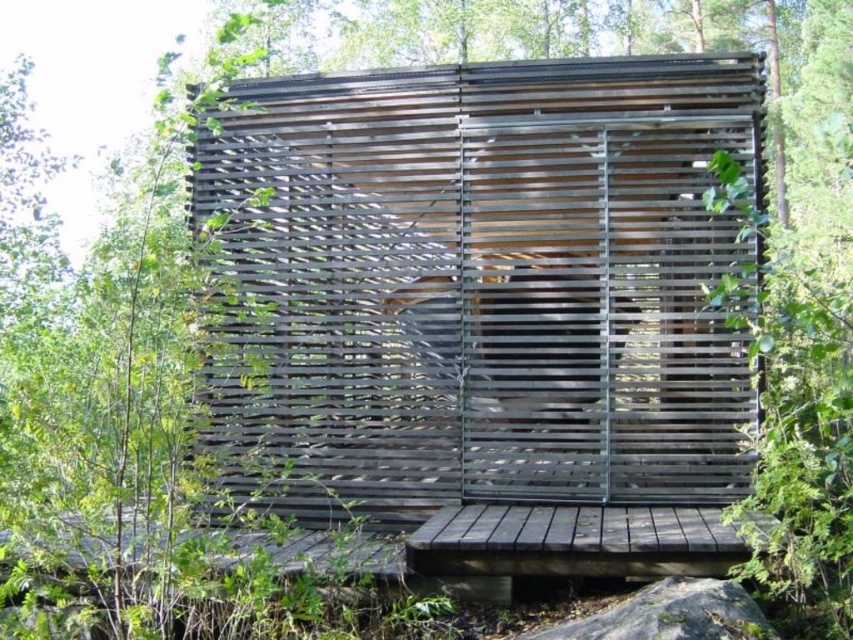
Does wooden slats at center appear under gray rough rock at lower center?

No.

Looking at this image, is wooden slats at center closer to camera compared to gray rough rock at lower center?

That is False.

Does point (418, 170) come closer to viewer compared to point (666, 588)?

No, it is behind (666, 588).

Locate an element on the screen. wooden slats at center is located at coordinates (490, 282).